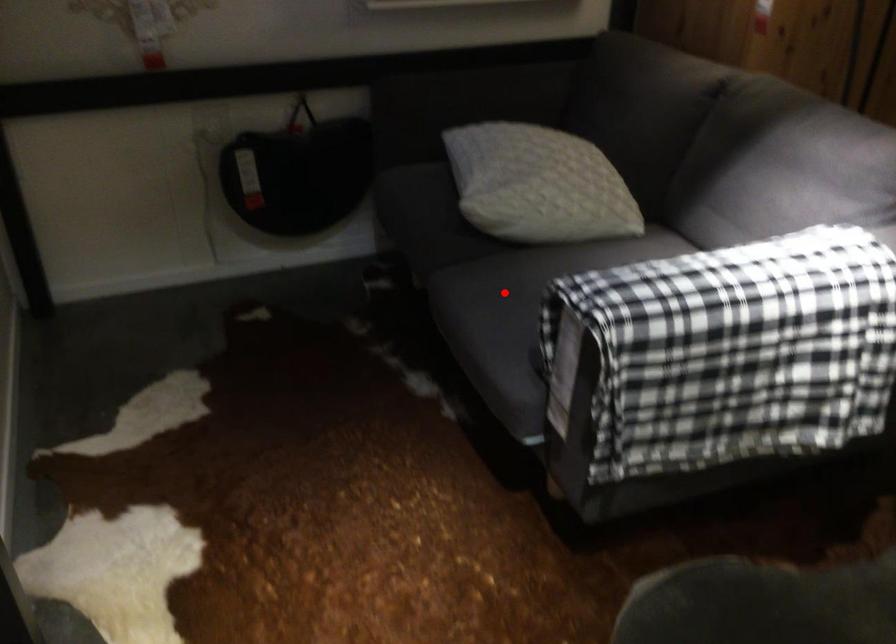
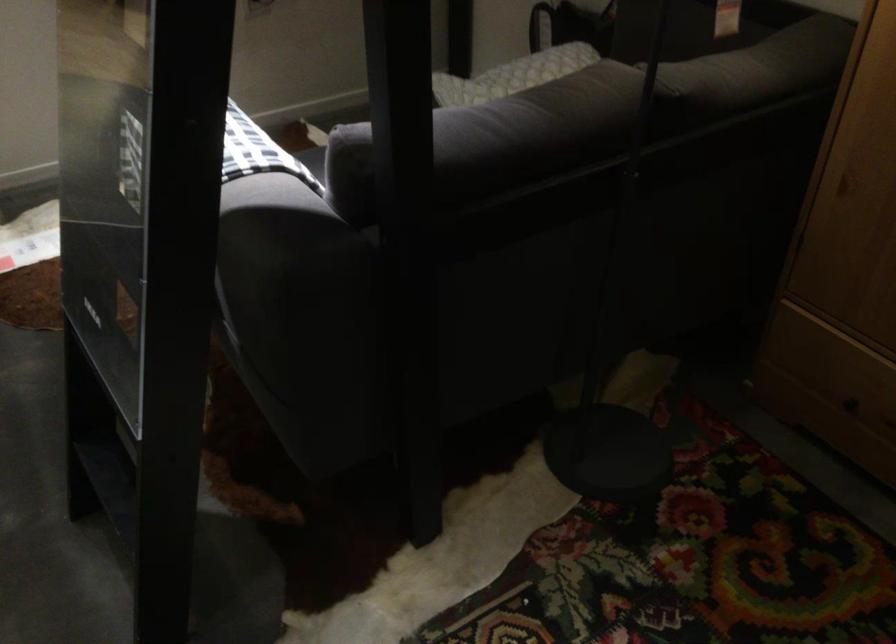
Question: I am providing you with two images of the same scene from different viewpoints. A red point is marked on the first image. Is the red point's position out of view in image 2?

Choices:
 (A) Yes
 (B) No

Answer: (A)